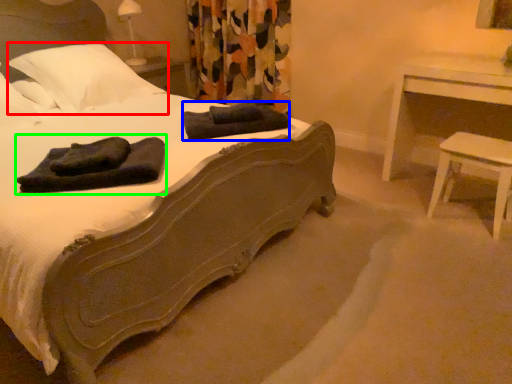
Question: Based on their relative distances, which object is farther from pillow (highlighted by a red box)? Choose from bath towel (highlighted by a blue box) and bath towel (highlighted by a green box).

Choices:
 (A) bath towel
 (B) bath towel

Answer: (B)